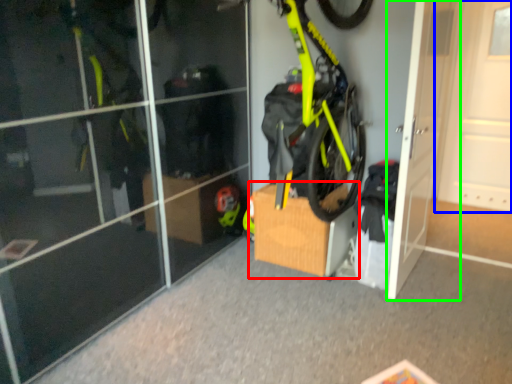
Question: Based on their relative distances, which object is farther from cardboard box (highlighted by a red box)? Choose from door (highlighted by a blue box) and door (highlighted by a green box).

Choices:
 (A) door
 (B) door

Answer: (A)